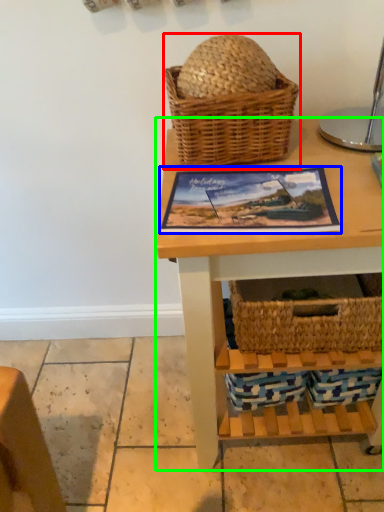
Question: Which is farther away from picnic basket (highlighted by a red box)? picture frame (highlighted by a blue box) or table (highlighted by a green box)?

Choices:
 (A) picture frame
 (B) table

Answer: (B)